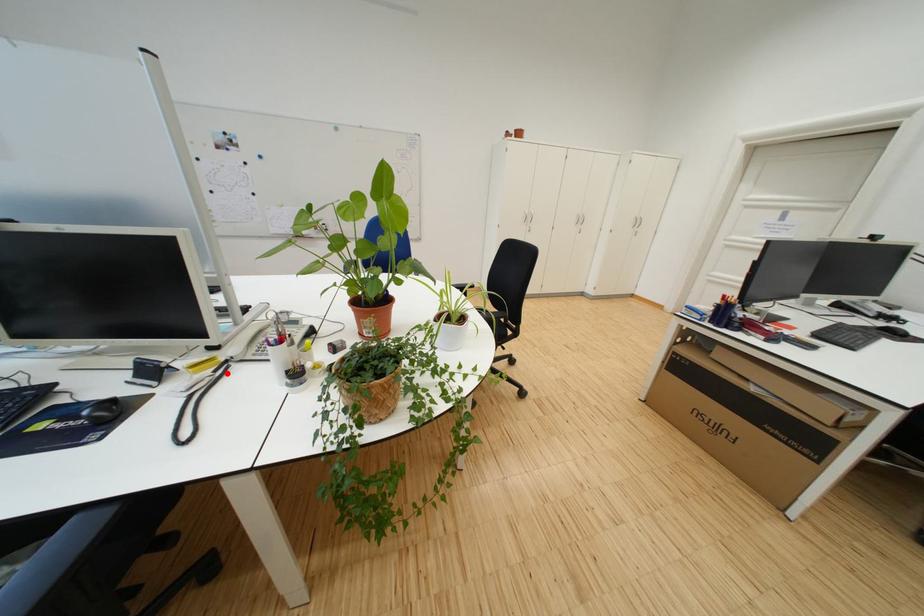
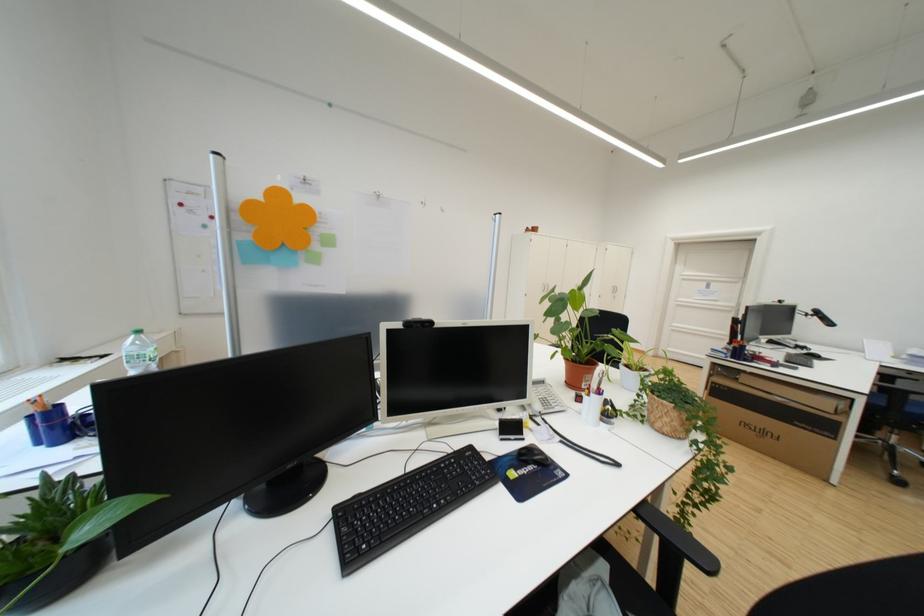
In the second image, find the point that corresponds to the highlighted location in the first image.

(551, 426)